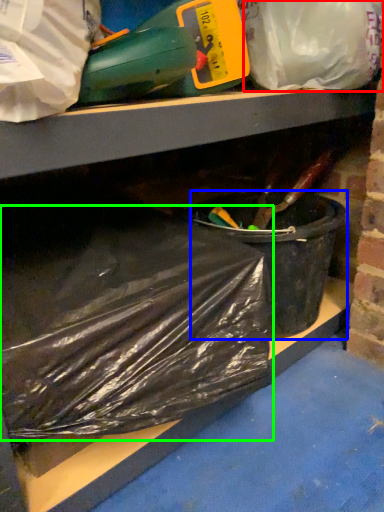
Question: Based on their relative distances, which object is nearer to plastic bag (highlighted by a red box)? Choose from recycling bin (highlighted by a blue box) and plastic bag (highlighted by a green box).

Choices:
 (A) recycling bin
 (B) plastic bag

Answer: (A)